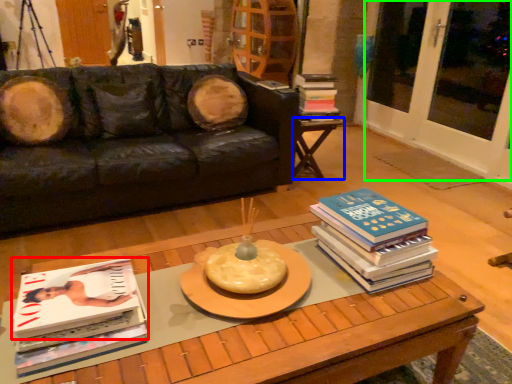
Question: Considering the real-world distances, which object is closest to book (highlighted by a red box)? table (highlighted by a blue box) or screen door (highlighted by a green box).

Choices:
 (A) table
 (B) screen door

Answer: (A)